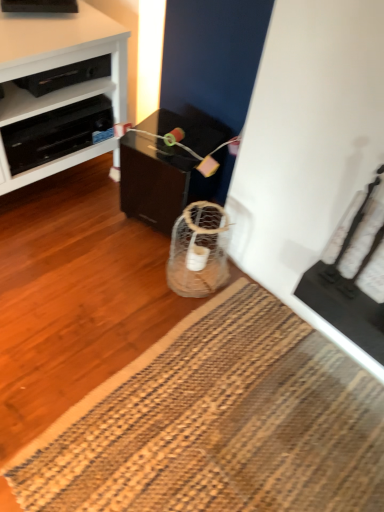
What are the coordinates of `vacant space underneath natural fiber mat at lower center (from a real-world perspective)` in the screenshot? It's located at (231, 421).